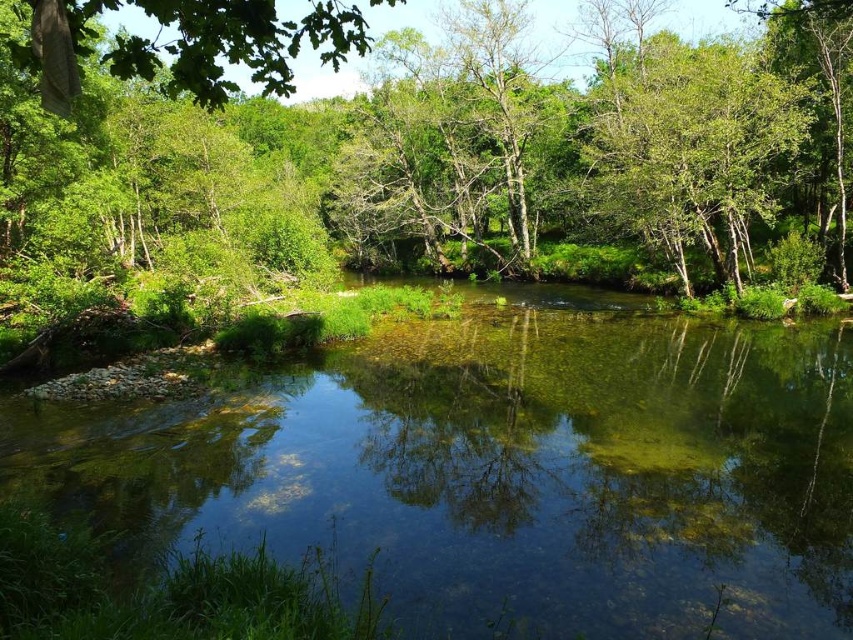
Question: Which point is farther to the camera?

Choices:
 (A) (36, 45)
 (B) (490, 442)
 (C) (21, 97)

Answer: (C)

Question: Can you confirm if green leafy tree at center is positioned above green leafy tree at upper right?

Choices:
 (A) yes
 (B) no

Answer: (A)

Question: Which object is closer to the camera taking this photo?

Choices:
 (A) green leafy tree at upper right
 (B) green leafy tree at center

Answer: (B)

Question: Is clear glass river at center further to the viewer compared to green leafy tree at center?

Choices:
 (A) no
 (B) yes

Answer: (B)

Question: Can you confirm if green leafy tree at center is positioned to the right of green leafy tree at upper left?

Choices:
 (A) yes
 (B) no

Answer: (A)

Question: Which is farther from the green leafy tree at upper left?

Choices:
 (A) green leafy tree at center
 (B) green leafy tree at upper right
 (C) clear glass river at center

Answer: (B)